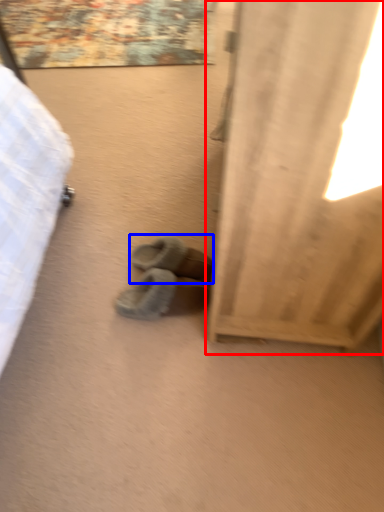
Question: Which object appears closest to the camera in this image, curtain (highlighted by a red box) or footwear (highlighted by a blue box)?

Choices:
 (A) curtain
 (B) footwear

Answer: (A)